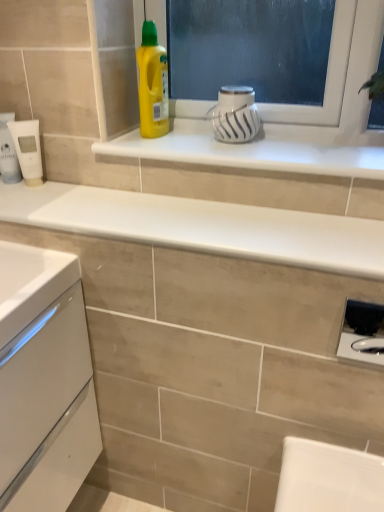
The image size is (384, 512). Identify the location of free location to the right of white matte tube at left. (64, 191).